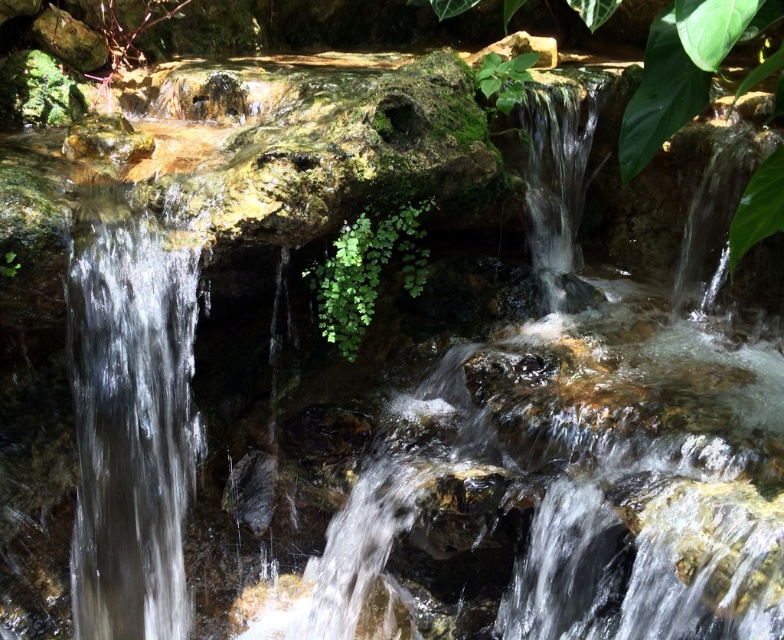
You are a botanist examining the green leafy plant at center and the green leafy plant at upper center in the waterfall scene. Which plant is positioned higher in the image?

The green leafy plant at upper center is positioned higher than the green leafy plant at center.

You are a photographer planning to capture both the clear glass waterfall at left and the green leafy plant at center in a single frame. Given that the camera can only focus on one subject at a time, which subject should you choose to ensure the larger one is in focus?

The clear glass waterfall at left is bigger than the green leafy plant at center, so you should focus on the clear glass waterfall at left to ensure the larger subject is in focus.